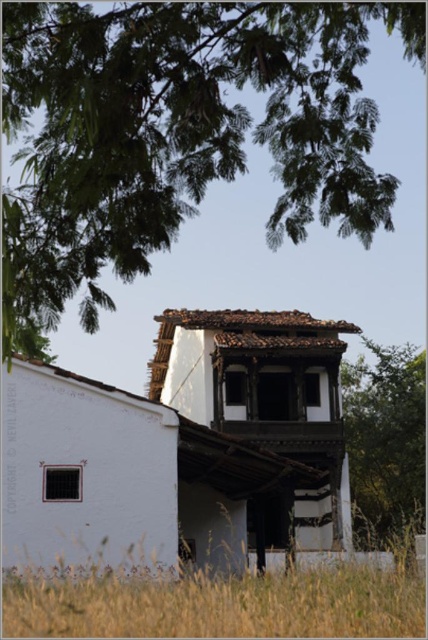
You are a gardener who needs to water both the green grass at lower left and the green leafy tree at center. If your watering can has a capacity that allows you to carry water 60 feet before needing to refill, can you water both areas without refilling?

The green grass at lower left and green leafy tree at center are 59.00 feet apart from each other. Since the distance is less than 60 feet, you can water both areas without needing to refill your watering can.

You are standing in front of the traditional building and notice two green leafy trees. One is labeled as the green leafy tree at upper center and the other as the green leafy tree at center. Which tree is located higher up in the image?

The green leafy tree at upper center is positioned over the green leafy tree at center, so it is higher up in the image.